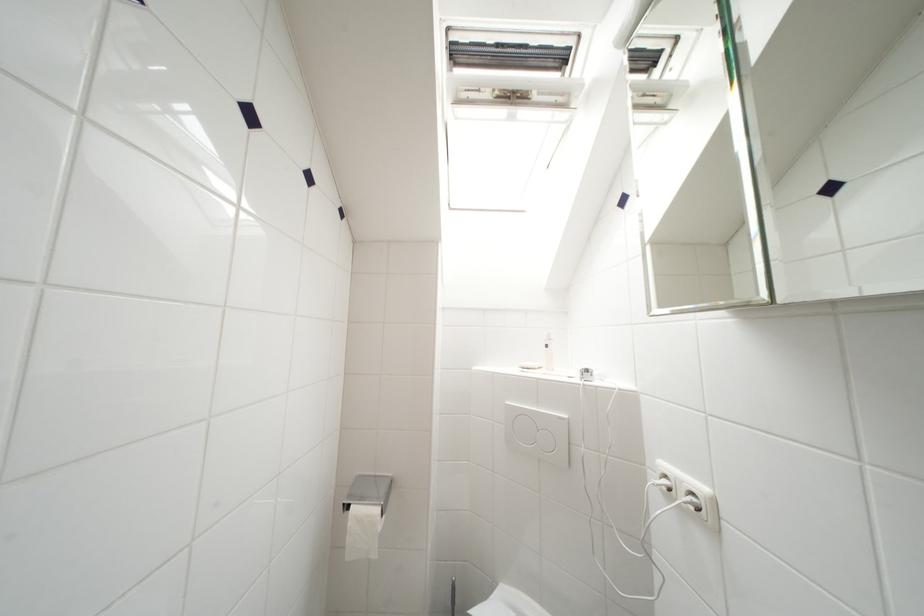
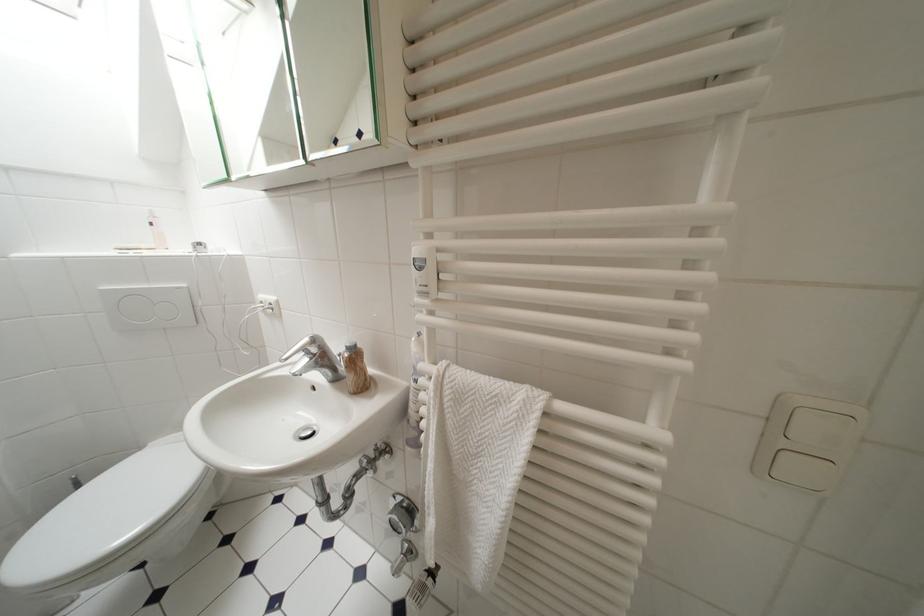
In the second image, find the point that corresponds to point (565, 421) in the first image.

(185, 291)